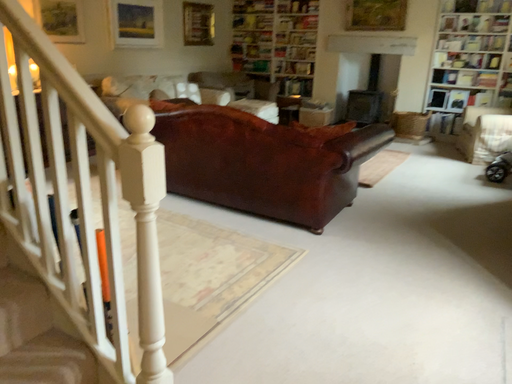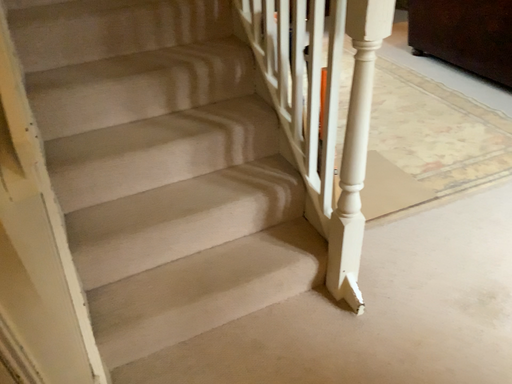
Question: How did the camera likely rotate when shooting the video?

Choices:
 (A) rotated upward
 (B) rotated downward

Answer: (B)